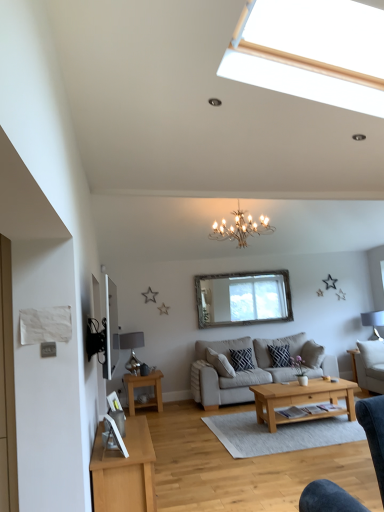
Question: In the image, is beige fabric couch at center positioned in front of or behind light brown wooden coffee table at center?

Choices:
 (A) front
 (B) behind

Answer: (B)

Question: Does point (284, 373) appear closer or farther from the camera than point (279, 417)?

Choices:
 (A) farther
 (B) closer

Answer: (A)

Question: Which object is the farthest from the gold metallic chandelier at upper center?

Choices:
 (A) beige fabric couch at center
 (B) metallic silver lamp at lower left, the 1th lamp in the front-to-back sequence
 (C) clear glass window at center
 (D) dark blue textured pillow at center
 (E) white fabric lampshade at right, the 2th lamp viewed from the left

Answer: (E)

Question: Which is farther from the beige fabric couch at center?

Choices:
 (A) white fabric lampshade at right, the 2th lamp viewed from the left
 (B) white glossy picture frame at lower left
 (C) light brown wooden coffee table at center
 (D) metallic silver lamp at lower left, which is the 1th lamp in left-to-right order
 (E) clear glass window at center

Answer: (B)